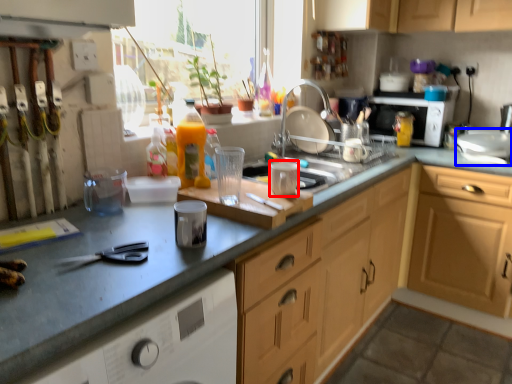
Question: Which of the following is the closest to the observer, appliance (highlighted by a red box) or appliance (highlighted by a blue box)?

Choices:
 (A) appliance
 (B) appliance

Answer: (A)